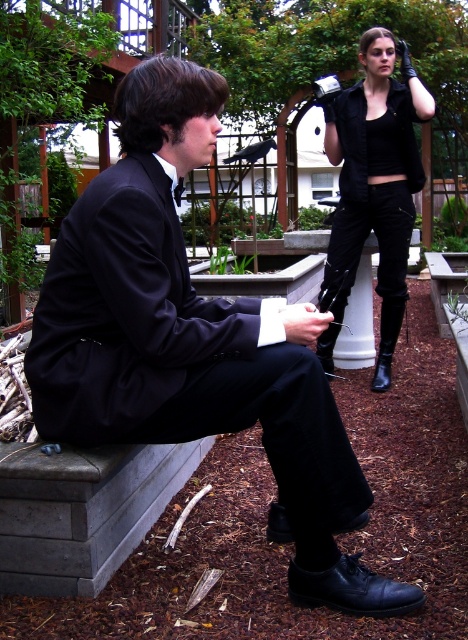
You are a photographer setting up for a photoshoot in the garden. You notice two black leather boots in the scene. Which boot is wider? The boots are labeled as black leather boot at lower right and black leather boot at lower center.

The black leather boot at lower right is wider than the black leather boot at lower center because its width surpasses the other as stated in the description.

You are standing at point A located at point (404, 216). You want to walk to the wooden pergola in the background. Is there enough space between you and the wooden pergola to walk comfortably? The average person requires 1.2 meters of space to walk comfortably.

The distance between you at point A located at point (404, 216) and the wooden pergola in the background is 3.95 meters. Since the required space for comfortable walking is 1.2 meters, there is more than enough space to walk comfortably between them.